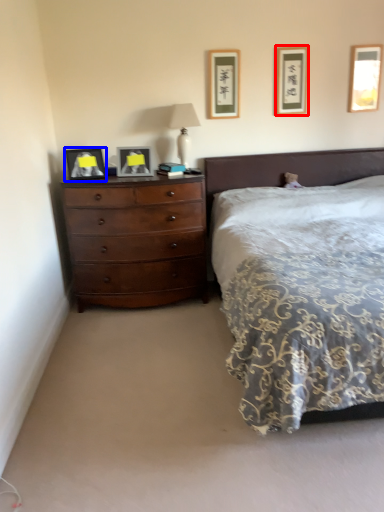
Question: Which point is further to the camera, picture frame (highlighted by a red box) or picture frame (highlighted by a blue box)?

Choices:
 (A) picture frame
 (B) picture frame

Answer: (A)